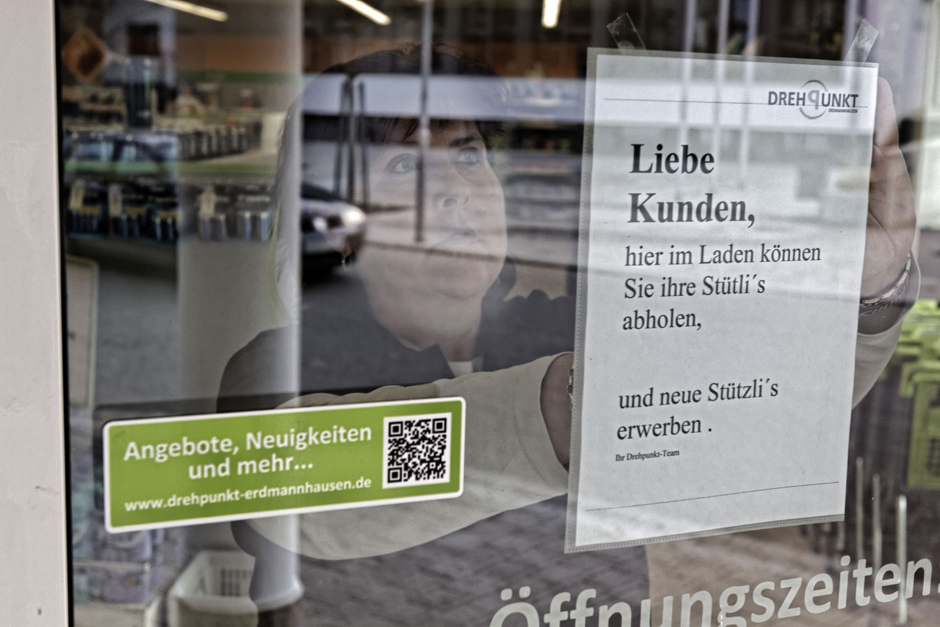
The image size is (940, 627). Find the location of `green chairs`. green chairs is located at coordinates (922, 401), (926, 369), (923, 338).